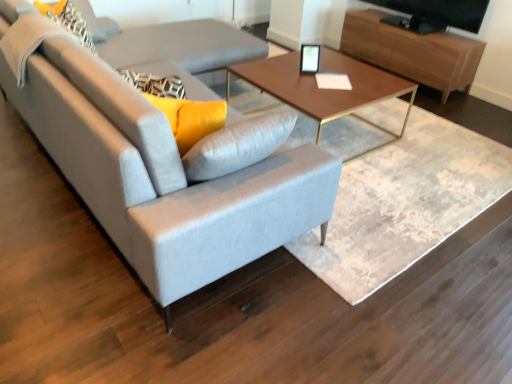
What do you see at coordinates (325, 89) in the screenshot? The height and width of the screenshot is (384, 512). I see `wooden/metallic coffee table at center` at bounding box center [325, 89].

This screenshot has width=512, height=384. Find the location of `light gray fabric couch at center`. light gray fabric couch at center is located at coordinates (166, 170).

What do you see at coordinates (412, 51) in the screenshot? This screenshot has width=512, height=384. I see `wooden entertainment center at upper right` at bounding box center [412, 51].

What are the coordinates of `wooden/metallic coffee table at center` in the screenshot? It's located at coord(325,89).

Does light gray fabric couch at center have a greater width compared to black glossy tv at upper right?

Correct, the width of light gray fabric couch at center exceeds that of black glossy tv at upper right.

From a real-world perspective, is light gray fabric couch at center positioned above or below black glossy tv at upper right?

In terms of real-world spatial position, light gray fabric couch at center is below black glossy tv at upper right.

Is light gray fabric couch at center next to black glossy tv at upper right?

No.

Considering the positions of objects light gray fabric couch at center and black glossy tv at upper right in the image provided, who is in front, light gray fabric couch at center or black glossy tv at upper right?

light gray fabric couch at center is in front.

Where is `coffee table in front of the wooden entertainment center at upper right`? coffee table in front of the wooden entertainment center at upper right is located at coordinates (325, 89).

Which of these two, wooden entertainment center at upper right or wooden/metallic coffee table at center, is thinner?

wooden entertainment center at upper right.

Considering the relative positions of wooden entertainment center at upper right and wooden/metallic coffee table at center in the image provided, is wooden entertainment center at upper right to the left of wooden/metallic coffee table at center from the viewer's perspective?

No, wooden entertainment center at upper right is not to the left of wooden/metallic coffee table at center.

Which is more to the left, black glossy tv at upper right or matte black picture frame at center?

From the viewer's perspective, matte black picture frame at center appears more on the left side.

Which of these two, black glossy tv at upper right or matte black picture frame at center, stands shorter?

With less height is matte black picture frame at center.

Is black glossy tv at upper right directly adjacent to matte black picture frame at center?

black glossy tv at upper right and matte black picture frame at center are not in contact.

Between point (478, 22) and point (300, 66), which one is positioned in front?

The point (300, 66) is closer to the camera.

Considering the positions of objects wooden entertainment center at upper right and light gray fabric couch at center in the image provided, who is more to the right, wooden entertainment center at upper right or light gray fabric couch at center?

wooden entertainment center at upper right.

Can you confirm if wooden entertainment center at upper right is smaller than light gray fabric couch at center?

Indeed, wooden entertainment center at upper right has a smaller size compared to light gray fabric couch at center.

Which of these two, wooden entertainment center at upper right or light gray fabric couch at center, is thinner?

With smaller width is wooden entertainment center at upper right.

Which is more to the right, black glossy tv at upper right or light gray fabric couch at center?

black glossy tv at upper right is more to the right.

Does black glossy tv at upper right come behind light gray fabric couch at center?

Yes, black glossy tv at upper right is further from the viewer.

Is point (470, 8) closer to camera compared to point (282, 216)?

No, (470, 8) is behind (282, 216).

This screenshot has height=384, width=512. Identify the location of television that appears on the right of light gray fabric couch at center. (435, 14).

Can you confirm if black glossy tv at upper right is smaller than wooden/metallic coffee table at center?

Correct, black glossy tv at upper right occupies less space than wooden/metallic coffee table at center.

From a real-world perspective, is black glossy tv at upper right positioned above or below wooden/metallic coffee table at center?

black glossy tv at upper right is situated higher than wooden/metallic coffee table at center in the real world.

From the image's perspective, between black glossy tv at upper right and wooden/metallic coffee table at center, which one is located above?

black glossy tv at upper right, from the image's perspective.

Which object is wider, black glossy tv at upper right or wooden/metallic coffee table at center?

wooden/metallic coffee table at center.

Considering the relative sizes of wooden/metallic coffee table at center and black glossy tv at upper right in the image provided, is wooden/metallic coffee table at center shorter than black glossy tv at upper right?

No.

From the image's perspective, which is below, wooden/metallic coffee table at center or black glossy tv at upper right?

wooden/metallic coffee table at center is shown below in the image.

From a real-world perspective, is wooden/metallic coffee table at center physically above black glossy tv at upper right?

No, from a real-world perspective, wooden/metallic coffee table at center is not on top of black glossy tv at upper right.

Based on the photo, can you confirm if wooden/metallic coffee table at center is positioned to the right of black glossy tv at upper right?

No, wooden/metallic coffee table at center is not to the right of black glossy tv at upper right.

In the image, there is a light gray fabric couch at center. Identify the location of television above it (from the image's perspective). The height and width of the screenshot is (384, 512). (435, 14).

The image size is (512, 384). Find the location of `coffee table to the left of wooden entertainment center at upper right`. coffee table to the left of wooden entertainment center at upper right is located at coordinates (325, 89).

Based on their spatial positions, is matte black picture frame at center or black glossy tv at upper right closer to light gray fabric couch at center?

matte black picture frame at center is closer to light gray fabric couch at center.

When comparing their distances from light gray fabric couch at center, does black glossy tv at upper right or matte black picture frame at center seem further?

black glossy tv at upper right is further to light gray fabric couch at center.

From the image, which object appears to be farther from wooden/metallic coffee table at center, wooden entertainment center at upper right or black glossy tv at upper right?

Among the two, black glossy tv at upper right is located further to wooden/metallic coffee table at center.

Based on their spatial positions, is light gray fabric couch at center or wooden entertainment center at upper right further from matte black picture frame at center?

Based on the image, light gray fabric couch at center appears to be further to matte black picture frame at center.

Looking at the image, which one is located further to matte black picture frame at center, light gray fabric couch at center or wooden/metallic coffee table at center?

light gray fabric couch at center is positioned further to the anchor matte black picture frame at center.

Based on their spatial positions, is wooden/metallic coffee table at center or black glossy tv at upper right closer to matte black picture frame at center?

wooden/metallic coffee table at center is closer to matte black picture frame at center.

When comparing their distances from matte black picture frame at center, does black glossy tv at upper right or light gray fabric couch at center seem closer?

black glossy tv at upper right.

Estimate the real-world distances between objects in this image. Which object is closer to light gray fabric couch at center, black glossy tv at upper right or wooden/metallic coffee table at center?

The object closer to light gray fabric couch at center is wooden/metallic coffee table at center.

Locate an element on the screen. coffee table between light gray fabric couch at center and wooden entertainment center at upper right along the z-axis is located at coordinates (325, 89).

At what (x,y) coordinates should I click in order to perform the action: click on television located between light gray fabric couch at center and wooden entertainment center at upper right in the depth direction. Please return your answer as a coordinate pair (x, y). The width and height of the screenshot is (512, 384). Looking at the image, I should click on (435, 14).

You are a GUI agent. You are given a task and a screenshot of the screen. Output one action in this format:
    pyautogui.click(x=<x>, y=<y>)
    Task: Click on the coffee table positioned between light gray fabric couch at center and matte black picture frame at center from near to far
    The width and height of the screenshot is (512, 384).
    Given the screenshot: What is the action you would take?
    pyautogui.click(x=325, y=89)

I want to click on picture frame between light gray fabric couch at center and wooden entertainment center at upper right from front to back, so click(x=310, y=59).